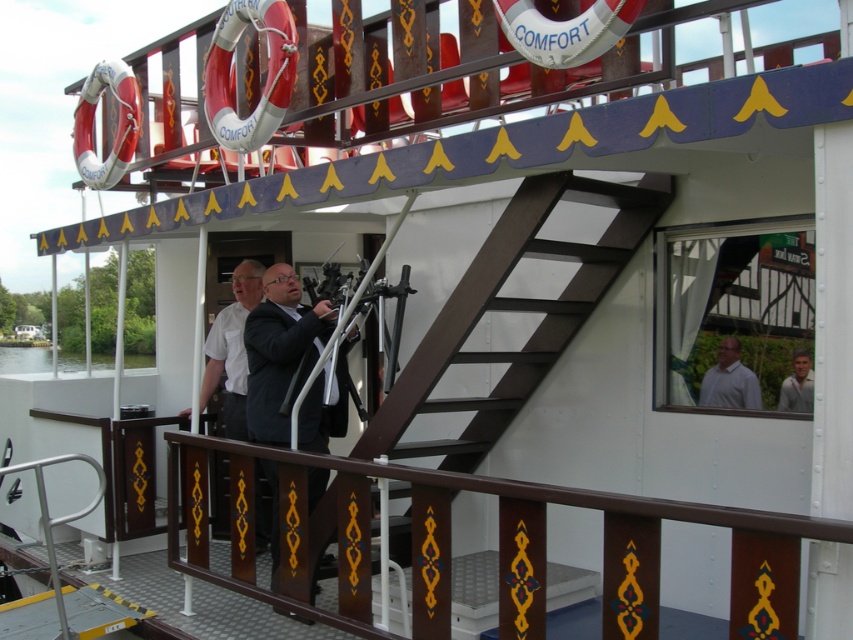
Question: Estimate the real-world distances between objects in this image. Which object is farther from the clear water at lower left?

Choices:
 (A) brown painted wood at lower center
 (B) light brown leather jacket at upper right

Answer: (B)

Question: Which point is closer to the camera?

Choices:
 (A) (167, 464)
 (B) (224, 374)

Answer: (A)

Question: Does white matte shirt at center have a larger size compared to light brown leather jacket at upper right?

Choices:
 (A) no
 (B) yes

Answer: (B)

Question: Among these points, which one is nearest to the camera?

Choices:
 (A) (735, 394)
 (B) (48, 368)
 (C) (213, 381)

Answer: (A)

Question: Where is dark gray suit at center located in relation to white matte shirt at upper right in the image?

Choices:
 (A) right
 (B) left

Answer: (B)

Question: Does white matte shirt at center appear on the left side of white matte shirt at upper right?

Choices:
 (A) no
 (B) yes

Answer: (B)